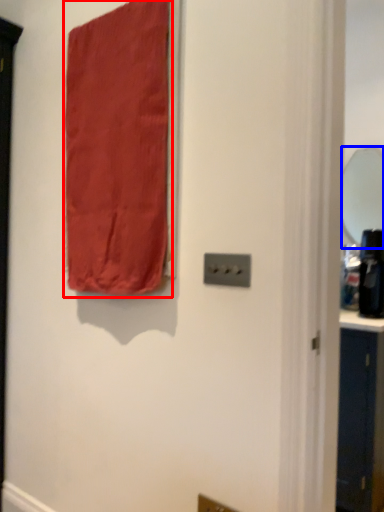
Question: Which of the following is the farthest to the observer, curtain (highlighted by a red box) or mirror (highlighted by a blue box)?

Choices:
 (A) curtain
 (B) mirror

Answer: (B)